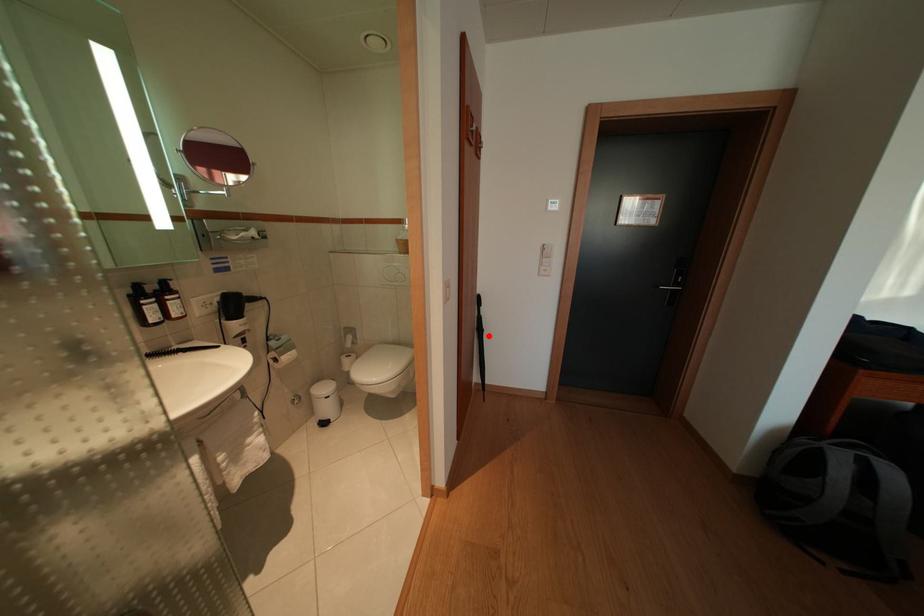
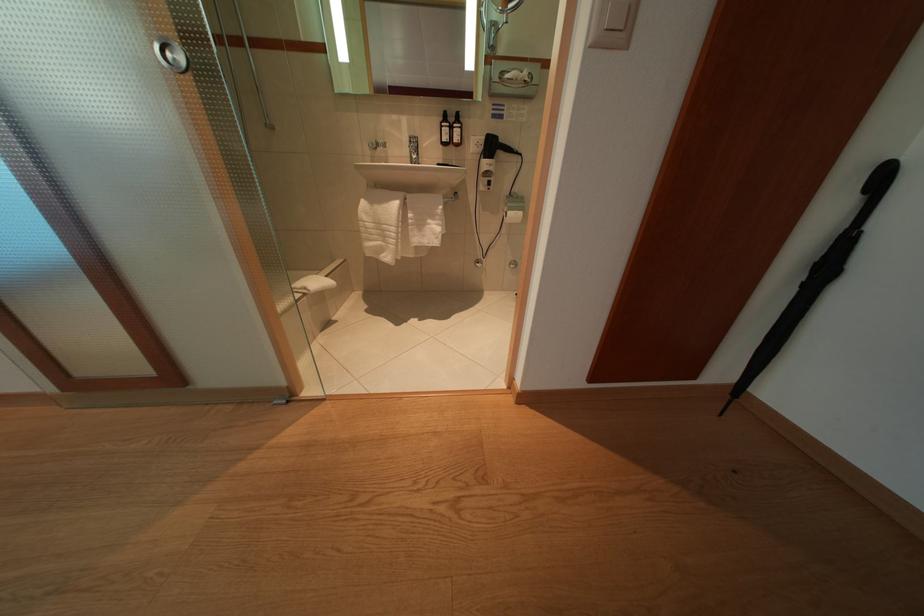
Find the pixel in the second image that matches the highlighted location in the first image.

(834, 275)